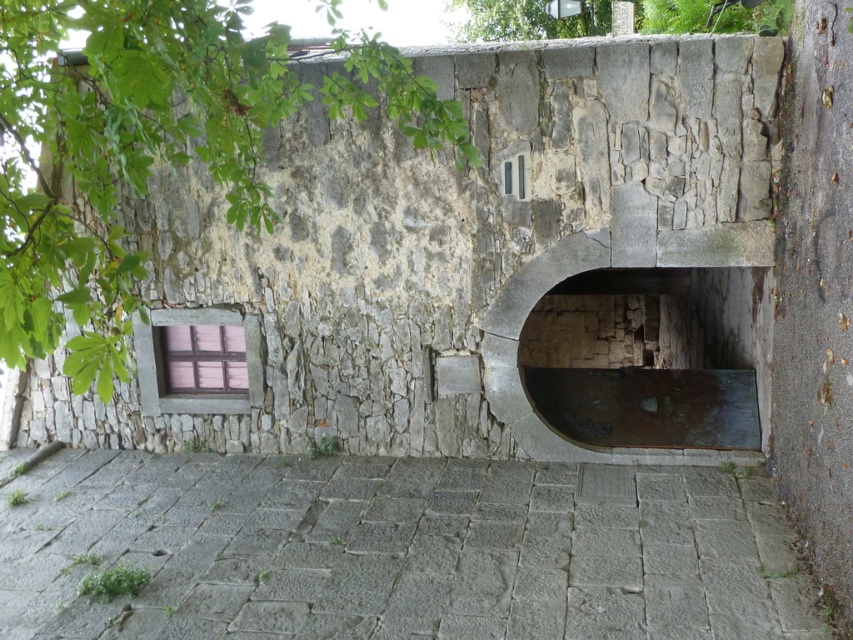
You are a maintenance worker assessing the old stone structure. You need to determine if the rusty metal door at center can be seen from the base of the green leafy tree at upper left. Based on their heights, can you see the door from there?

The rusty metal door at center has a greater height compared to green leafy tree at upper left, so yes, the door can be seen from the base of the green leafy tree at upper left because it is taller and more visible over the tree.

You are standing in front of an old stone wall with a rusty metal door at center and a bronze metallic archway at center. Which object is positioned to the left of the other?

The rusty metal door at center is to the left of the bronze metallic archway at center.

You are an architect examining the old stone structure. You notice the bronze metallic archway at center and the green leafy tree at upper center. Which of these two objects has a smaller width?

The bronze metallic archway at center has a lesser width compared to the green leafy tree at upper center.